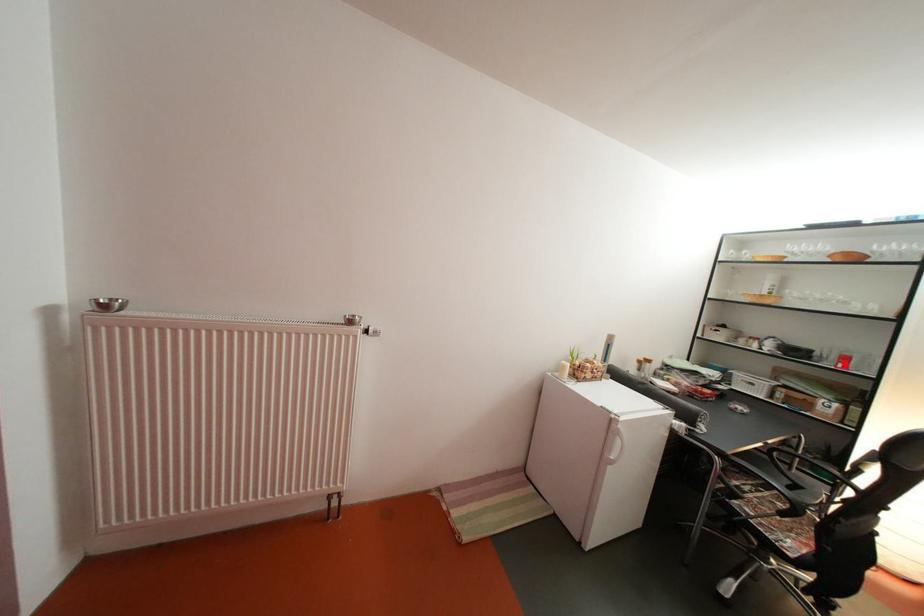
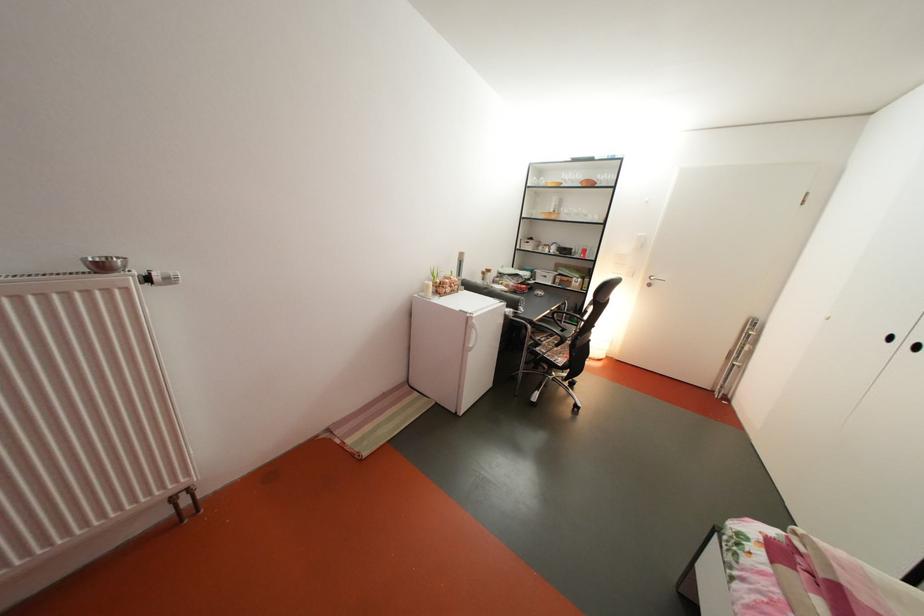
Question: I am providing you with two images of the same scene from different viewpoints. A red point is marked on the first image. Can you still see the location of the red point in image 2?

Choices:
 (A) Yes
 (B) No

Answer: (A)